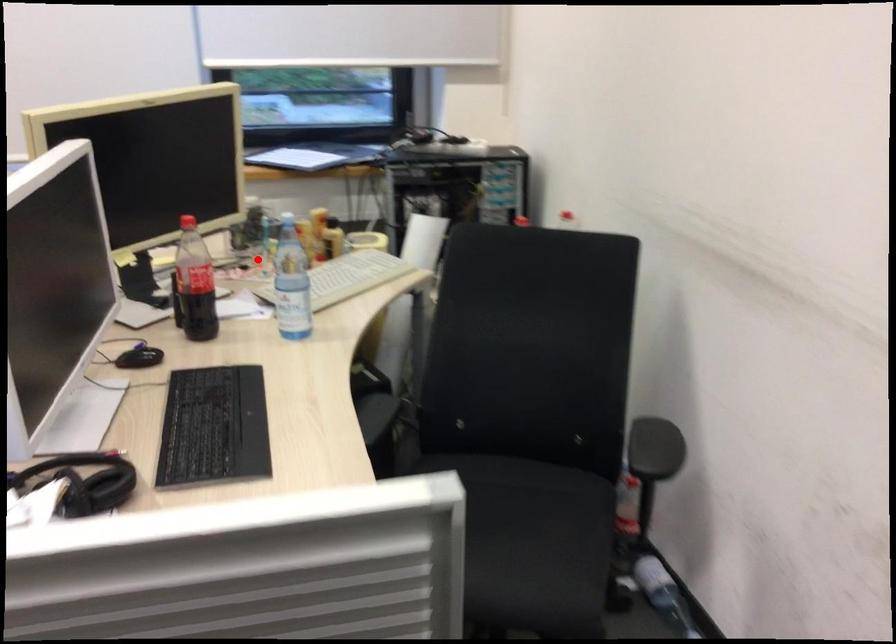
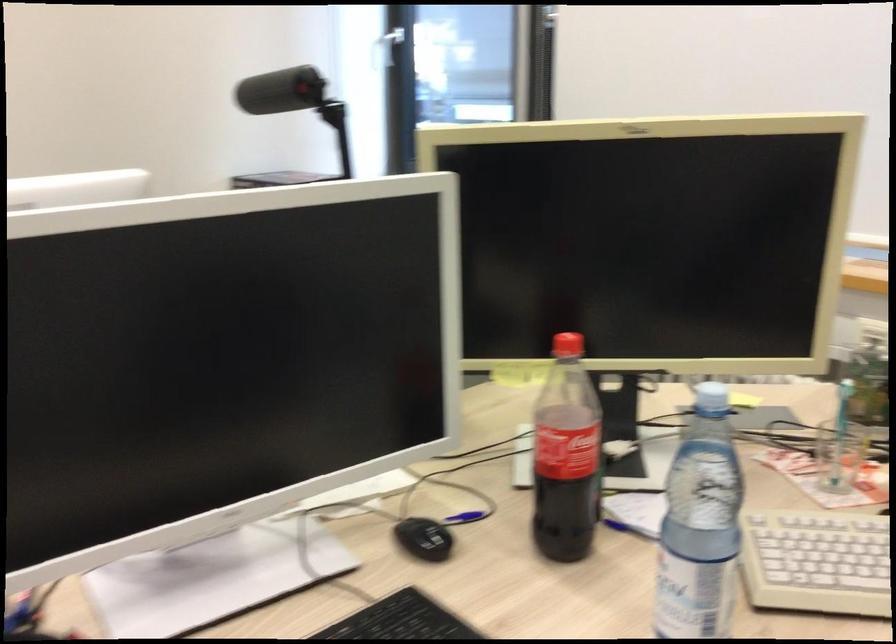
Question: I am providing you with two images of the same scene from different viewpoints. Given a red point in image1, look at the same physical point in image2. Is it:

Choices:
 (A) Closer to the viewpoint
 (B) Farther from the viewpoint

Answer: (A)